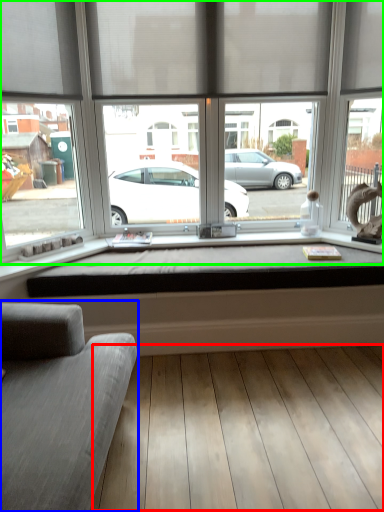
Question: Which is nearer to the plank (highlighted by a red box)? studio couch (highlighted by a blue box) or window (highlighted by a green box).

Choices:
 (A) studio couch
 (B) window

Answer: (A)